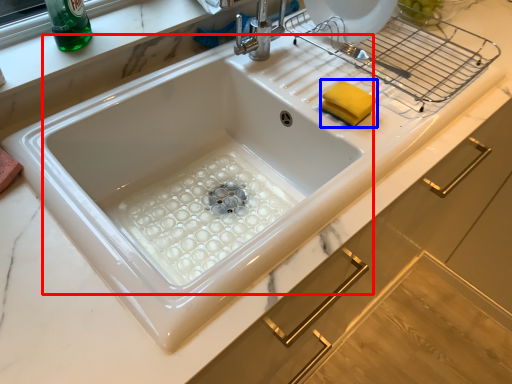
Question: Which of the following is the closest to the observer, sink (highlighted by a red box) or food (highlighted by a blue box)?

Choices:
 (A) sink
 (B) food

Answer: (A)